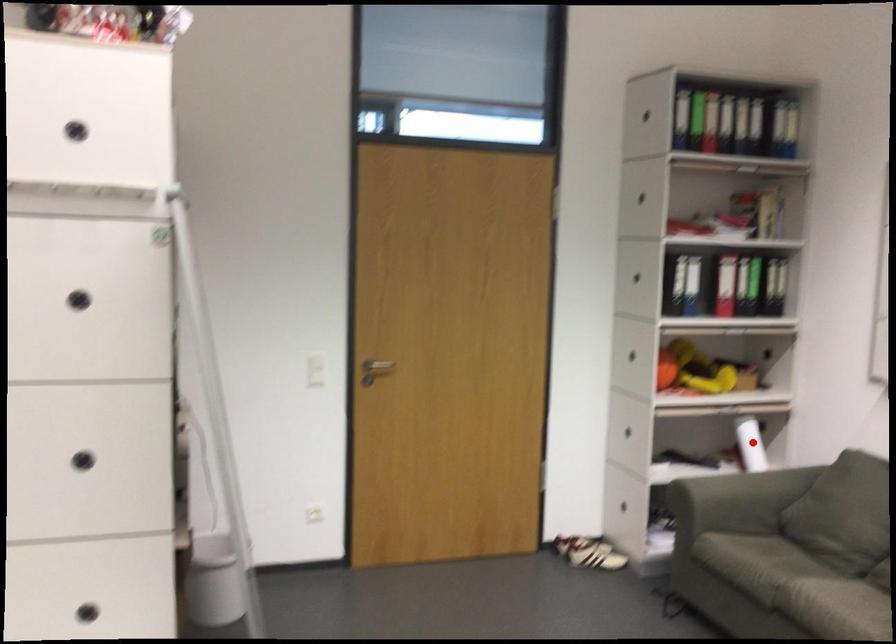
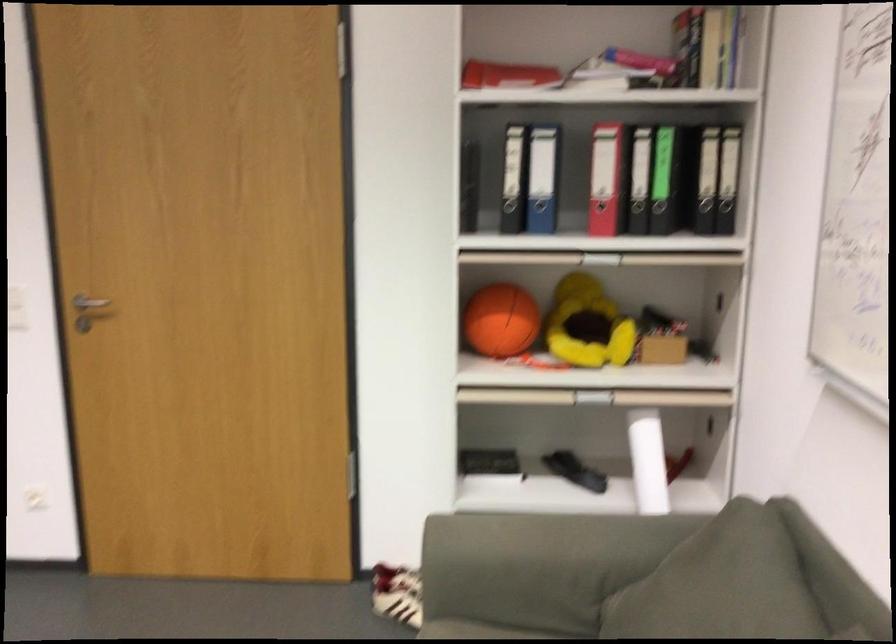
The point at the highlighted location is marked in the first image. Where is the corresponding point in the second image?

(648, 460)